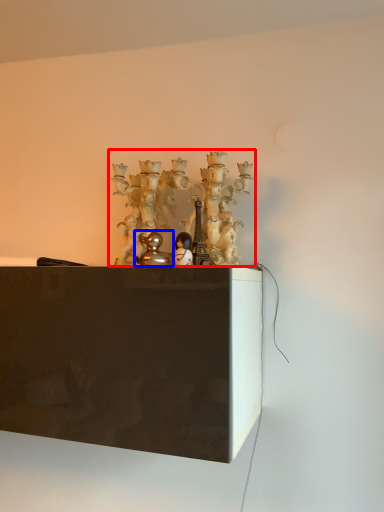
Question: Which object is further to the camera taking this photo, art (highlighted by a red box) or toy (highlighted by a blue box)?

Choices:
 (A) art
 (B) toy

Answer: (A)